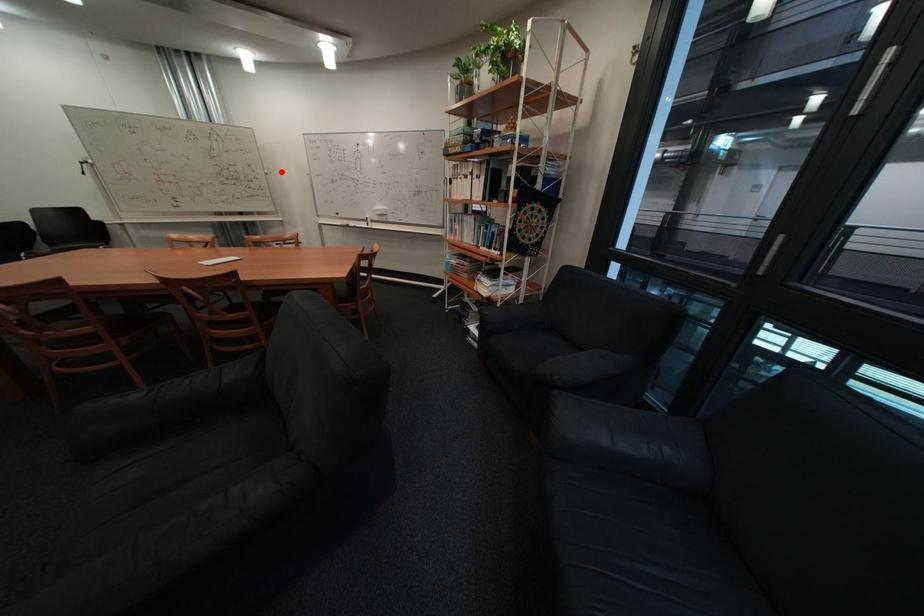
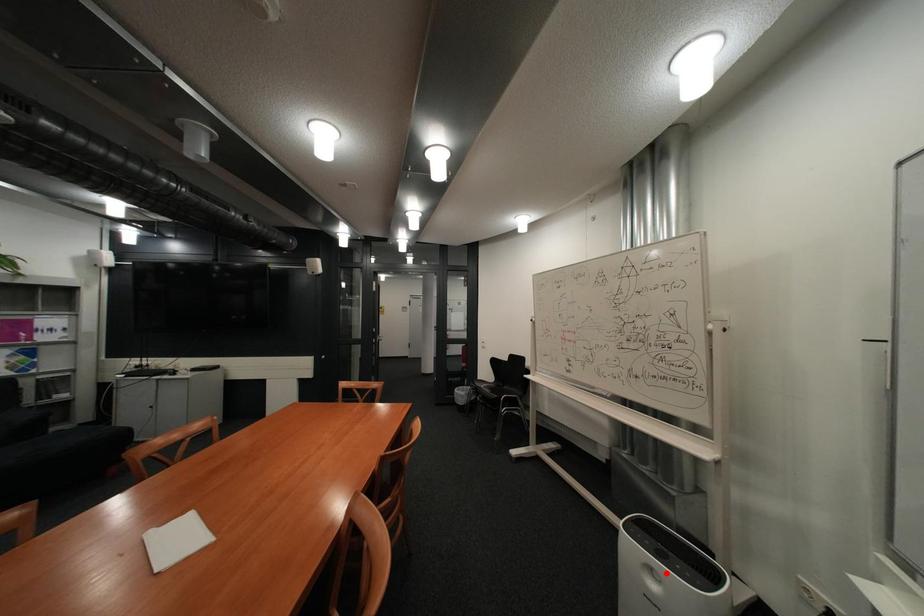
I am providing you with two images of the same scene from different viewpoints. A red point is marked on the first image and another point is marked on the second image. Is the red point in image1 aligned with the point shown in image2?

No